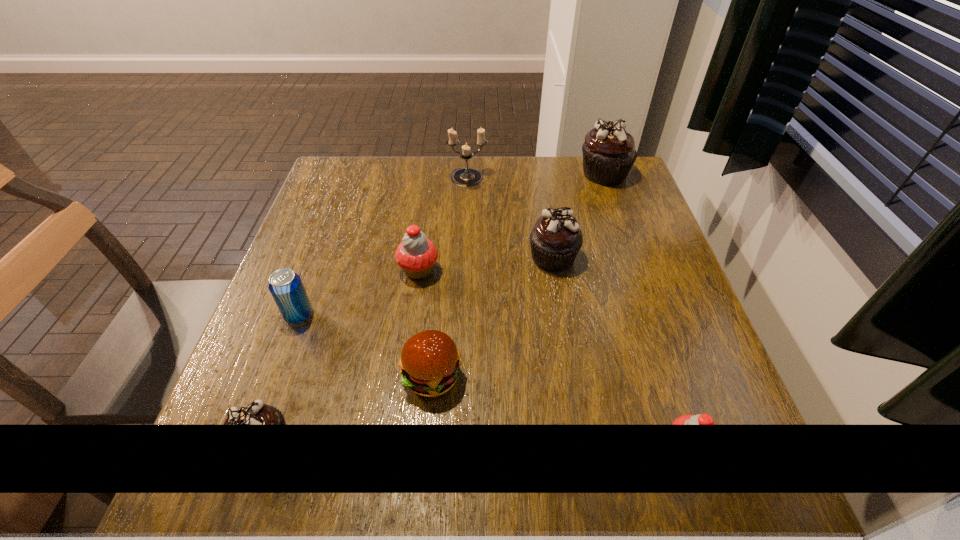
At what (x,y) coordinates should I click in order to perform the action: click on blank space at the far edge. Please return your answer as a coordinate pair (x, y). Looking at the image, I should click on (520, 176).

In order to click on free region at the near edge of the desktop in this screenshot , I will do `click(333, 474)`.

At what (x,y) coordinates should I click in order to perform the action: click on vacant region at the left edge of the desktop. Please return your answer as a coordinate pair (x, y). This screenshot has width=960, height=540. Looking at the image, I should click on (263, 322).

At what (x,y) coordinates should I click in order to perform the action: click on vacant area at the right edge. Please return your answer as a coordinate pair (x, y). The height and width of the screenshot is (540, 960). Looking at the image, I should click on (x=622, y=294).

Identify the location of free space between the candle holder and the smallest brown cupcake. (366, 311).

Where is `unoccupied area between the brown hamburger and the farther red cupcake`? unoccupied area between the brown hamburger and the farther red cupcake is located at coordinates (425, 323).

Find the location of `free space that is in between the candle holder and the right red cupcake`. free space that is in between the candle holder and the right red cupcake is located at coordinates (577, 313).

Image resolution: width=960 pixels, height=540 pixels. I want to click on vacant space that is in between the brown hamburger and the smaller red cupcake, so click(560, 411).

You are a GUI agent. You are given a task and a screenshot of the screen. Output one action in this format:
    pyautogui.click(x=<x>, y=<y>)
    Task: Click on the vacant area that lies between the brown hamburger and the candle holder
    The height and width of the screenshot is (540, 960).
    Given the screenshot: What is the action you would take?
    pyautogui.click(x=449, y=278)

Locate an element on the screen. vacant area between the farthest brown cupcake and the blue beer can is located at coordinates pyautogui.click(x=452, y=245).